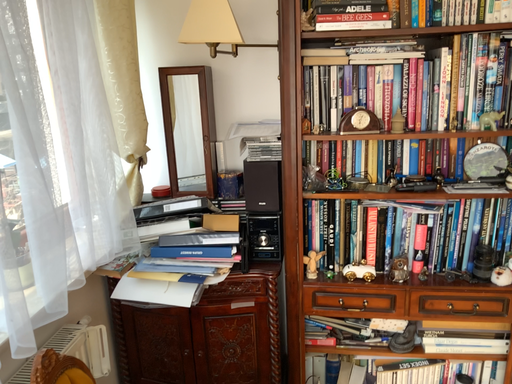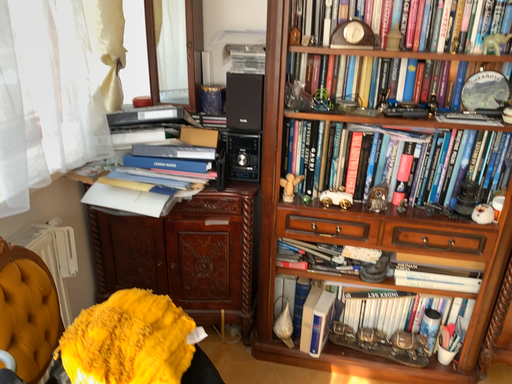
Question: Which way did the camera rotate in the video?

Choices:
 (A) rotated downward
 (B) rotated upward

Answer: (A)